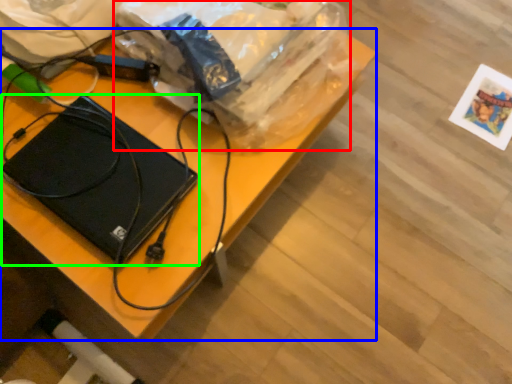
Question: Which object is the farthest from grocery bag (highlighted by a red box)? Choose among these: desk (highlighted by a blue box) or laptop (highlighted by a green box).

Choices:
 (A) desk
 (B) laptop

Answer: (B)